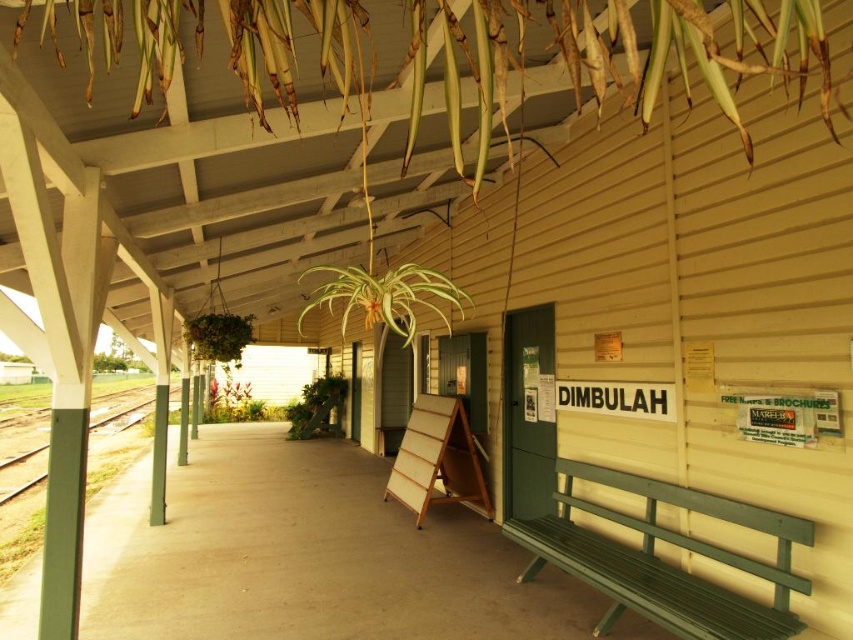
Question: Is green leafy plant at upper left to the right of green leafy plant at lower left from the viewer's perspective?

Choices:
 (A) yes
 (B) no

Answer: (A)

Question: Which is nearer to the green leafy plant at upper center?

Choices:
 (A) green wooden bench at lower right
 (B) green leafy plant at lower left
 (C) green leafy plant at center
 (D) green leafy plant at upper left

Answer: (A)

Question: Can you confirm if green leafy plant at center is smaller than green leafy plant at lower left?

Choices:
 (A) yes
 (B) no

Answer: (A)

Question: Which of the following is the farthest from the observer?

Choices:
 (A) green wooden bench at lower right
 (B) green leafy plant at upper center
 (C) green leafy plant at upper left
 (D) green leafy plant at lower left

Answer: (D)

Question: Is green leafy plant at upper center to the right of green leafy plant at center from the viewer's perspective?

Choices:
 (A) no
 (B) yes

Answer: (B)

Question: Considering the real-world distances, which object is closest to the green leafy plant at lower left?

Choices:
 (A) green leafy plant at upper left
 (B) green wooden bench at lower right
 (C) green leafy plant at center

Answer: (C)